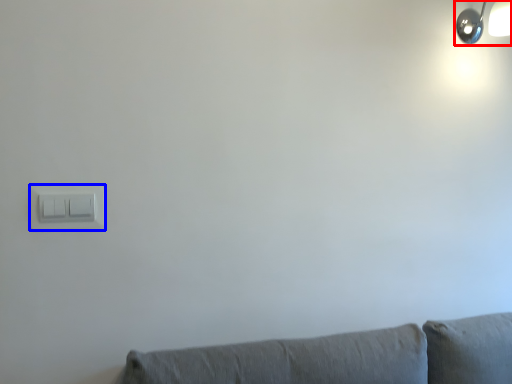
Question: Which point is closer to the camera, lamp (highlighted by a red box) or light switch (highlighted by a blue box)?

Choices:
 (A) lamp
 (B) light switch

Answer: (B)